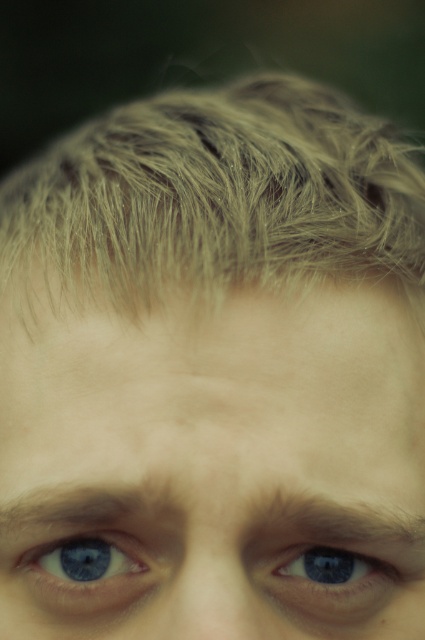
Question: Does blue skin at center lie behind blue glossy eye at center?

Choices:
 (A) no
 (B) yes

Answer: (A)

Question: Which point appears farthest from the camera in this image?

Choices:
 (A) (359, 406)
 (B) (164, 106)
 (C) (93, 577)
 (D) (343, 573)

Answer: (B)

Question: In this image, where is blue skin at center located relative to blue glossy eye at lower left?

Choices:
 (A) right
 (B) left

Answer: (A)

Question: Can you confirm if blonde textured hair at upper center is smaller than blue glossy eye at lower left?

Choices:
 (A) yes
 (B) no

Answer: (B)

Question: Among these objects, which one is farthest from the camera?

Choices:
 (A) blue glossy eye at lower left
 (B) blue skin at center

Answer: (A)

Question: Which object is positioned closest to the blue glossy eye at center?

Choices:
 (A) blue glossy eye at lower left
 (B) blonde textured hair at upper center
 (C) blue skin at center

Answer: (C)